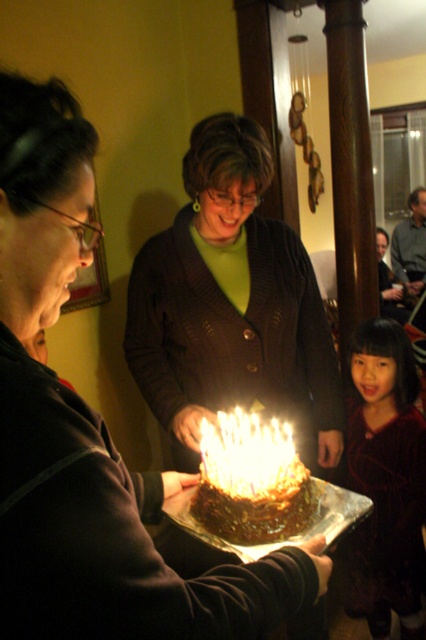
Can you confirm if matte brown sweater at center is taller than golden wax candle at center?

Indeed, matte brown sweater at center has a greater height compared to golden wax candle at center.

Is matte brown sweater at center wider than golden wax candle at center?

Yes.

Image resolution: width=426 pixels, height=640 pixels. Describe the element at coordinates (89, 433) in the screenshot. I see `matte brown sweater at center` at that location.

The image size is (426, 640). Identify the location of matte brown sweater at center. (89, 433).

Who is more distant from viewer, (x=239, y=371) or (x=290, y=468)?

Point (x=239, y=371)

Is point (196, 410) positioned in front of point (268, 428)?

Yes, it is in front of point (268, 428).

You are a GUI agent. You are given a task and a screenshot of the screen. Output one action in this format:
    pyautogui.click(x=<x>, y=<y>)
    Task: Click on the dark brown sweater at center
    The height and width of the screenshot is (640, 426).
    Given the screenshot: What is the action you would take?
    pyautogui.click(x=232, y=305)

Can you confirm if matte brown sweater at center is thinner than velvet dark dress at lower right?

In fact, matte brown sweater at center might be wider than velvet dark dress at lower right.

Does matte brown sweater at center have a greater width compared to velvet dark dress at lower right?

Correct, the width of matte brown sweater at center exceeds that of velvet dark dress at lower right.

Find the location of a particular element. matte brown sweater at center is located at coordinates (89, 433).